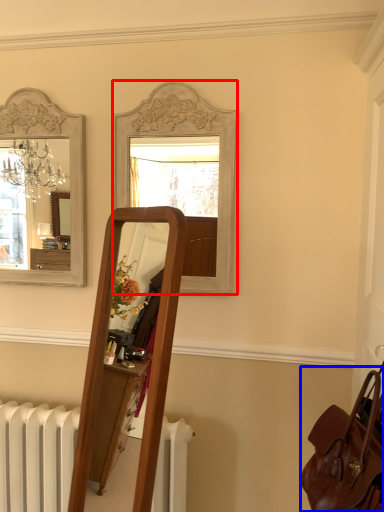
Question: Which point is further to the camera, mirror (highlighted by a red box) or bag (highlighted by a blue box)?

Choices:
 (A) mirror
 (B) bag

Answer: (A)